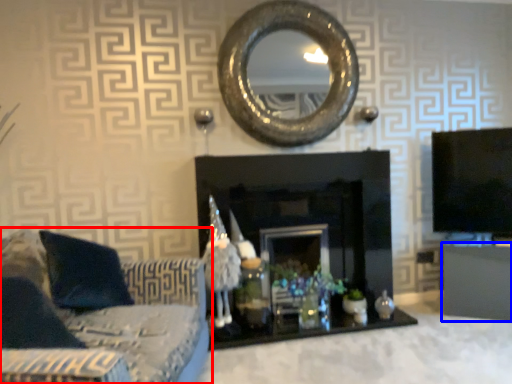
Question: Among these objects, which one is farthest to the camera, studio couch (highlighted by a red box) or furniture (highlighted by a blue box)?

Choices:
 (A) studio couch
 (B) furniture

Answer: (B)